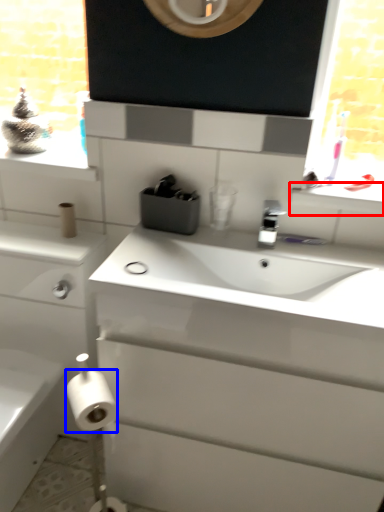
Question: Among these objects, which one is nearest to the camera, window sill (highlighted by a red box) or toilet paper (highlighted by a blue box)?

Choices:
 (A) window sill
 (B) toilet paper

Answer: (B)